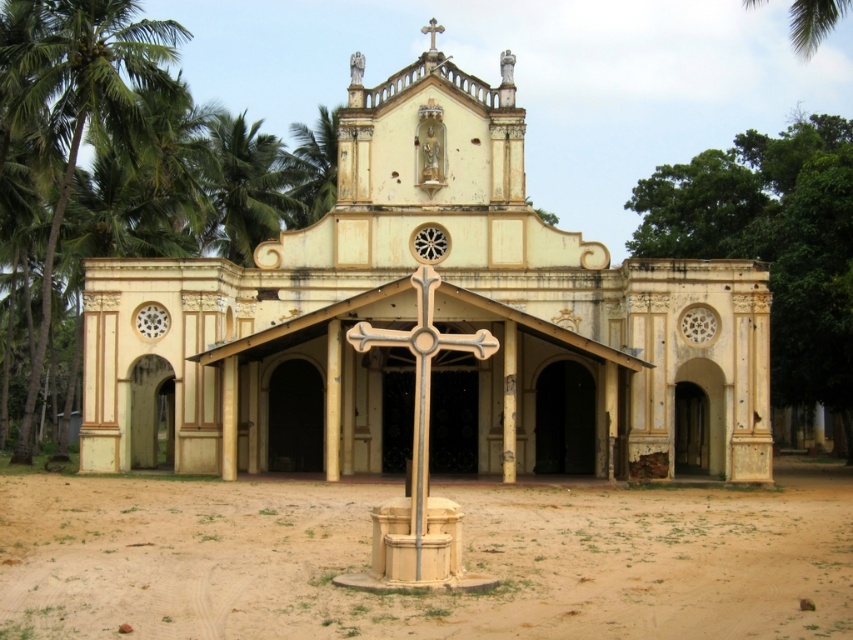
Does point (476, 81) lie in front of point (431, 48)?

Yes, point (476, 81) is closer to viewer.

Is point (376, 248) in front of point (432, 35)?

Yes, point (376, 248) is in front of point (432, 35).

Where is `white weathered church at center`? This screenshot has width=853, height=640. white weathered church at center is located at coordinates (444, 321).

Who is shorter, green leafy palm tree at upper left or white stone cross at upper center?

With less height is white stone cross at upper center.

Is point (268, 195) closer to camera compared to point (442, 29)?

No, (268, 195) is further to viewer.

Is point (234, 170) less distant than point (430, 28)?

No, it is behind (430, 28).

This screenshot has width=853, height=640. In order to click on green leafy palm tree at upper left in this screenshot , I will do `click(244, 188)`.

Is white weathered church at center thinner than green leafy palm tree at left?

No, white weathered church at center is not thinner than green leafy palm tree at left.

Is white weathered church at center shorter than green leafy palm tree at left?

Yes, white weathered church at center is shorter than green leafy palm tree at left.

Locate an element on the screen. This screenshot has width=853, height=640. white weathered church at center is located at coordinates (444, 321).